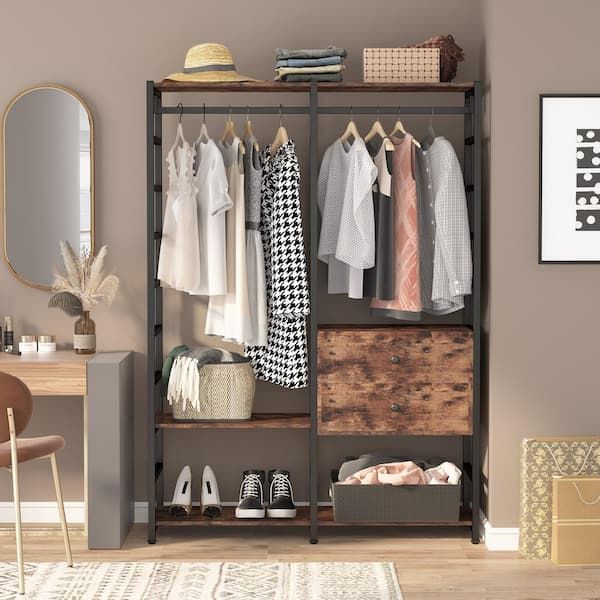
You are a GUI agent. You are given a task and a screenshot of the screen. Output one action in this format:
    pyautogui.click(x=<x>, y=<y>)
    Task: Click on the folded clothes
    
    Given the screenshot: What is the action you would take?
    pyautogui.click(x=315, y=50), pyautogui.click(x=315, y=60), pyautogui.click(x=315, y=69), pyautogui.click(x=316, y=77)